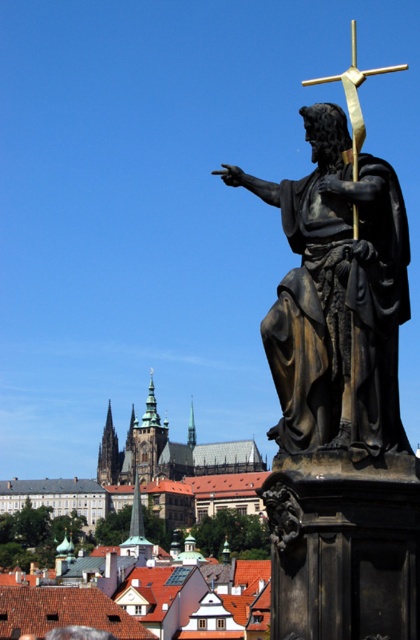
Which is in front, point (359, 147) or point (70, 625)?

Positioned in front is point (359, 147).

Does gold polished crucifix at upper center have a greater height compared to shiny gold statue at right?

Correct, gold polished crucifix at upper center is much taller as shiny gold statue at right.

Does point (356, 230) come in front of point (102, 632)?

Yes, it is in front of point (102, 632).

Locate an element on the screen. The image size is (420, 640). gold polished crucifix at upper center is located at coordinates (354, 99).

Between point (354, 380) and point (78, 625), which one is positioned behind?

Positioned behind is point (78, 625).

Which of these two, bronze statue at right or shiny gold statue at right, stands shorter?

shiny gold statue at right

Who is more distant from viewer, (x=367, y=195) or (x=49, y=632)?

The point (x=49, y=632) is behind.

Locate an element on the screen. The width and height of the screenshot is (420, 640). bronze statue at right is located at coordinates (336, 296).

Can you confirm if bronze statue at right is positioned below gold polished crucifix at upper center?

Indeed, bronze statue at right is positioned under gold polished crucifix at upper center.

Can you confirm if bronze statue at right is positioned above gold polished crucifix at upper center?

Incorrect, bronze statue at right is not positioned above gold polished crucifix at upper center.

Describe the element at coordinates (336, 296) in the screenshot. I see `bronze statue at right` at that location.

In order to click on bronze statue at right in this screenshot , I will do `click(336, 296)`.